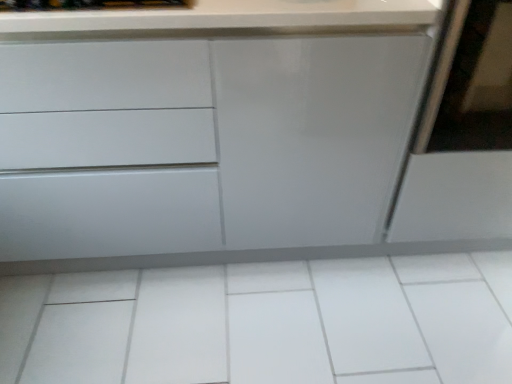
The image size is (512, 384). What do you see at coordinates (232, 138) in the screenshot?
I see `matte white cabinet at center` at bounding box center [232, 138].

What are the coordinates of `matte white screen door at right` in the screenshot? It's located at (452, 181).

Measure the distance between matte white screen door at right and matte white cabinet at center.

A distance of 13.33 inches exists between matte white screen door at right and matte white cabinet at center.

Is the depth of matte white screen door at right greater than that of matte white cabinet at center?

Yes, it is.

Can you see matte white screen door at right touching matte white cabinet at center?

No, matte white screen door at right is not with matte white cabinet at center.

Is matte white screen door at right surrounded by matte white cabinet at center?

Actually, matte white screen door at right is outside matte white cabinet at center.

Can you confirm if matte white cabinet at center is thinner than matte white screen door at right?

Indeed, matte white cabinet at center has a lesser width compared to matte white screen door at right.

What's the angular difference between white glossy tile at center and matte white screen door at right's facing directions?

89.2 degrees.

Could you tell me if white glossy tile at center is turned towards matte white screen door at right?

No, white glossy tile at center does not turn towards matte white screen door at right.

Does white glossy tile at center have a lesser height compared to matte white screen door at right?

Indeed, white glossy tile at center has a lesser height compared to matte white screen door at right.

From the image's perspective, which one is positioned lower, white glossy tile at center or matte white screen door at right?

From the image's view, white glossy tile at center is below.

Considering the sizes of objects matte white screen door at right and white glossy tile at center in the image provided, who is taller, matte white screen door at right or white glossy tile at center?

With more height is matte white screen door at right.

From the image's perspective, is matte white screen door at right positioned above or below white glossy tile at center?

Based on their image positions, matte white screen door at right is located above white glossy tile at center.

Which is more to the right, matte white screen door at right or white glossy tile at center?

matte white screen door at right is more to the right.

Can you tell me how much matte white screen door at right and white glossy tile at center differ in facing direction?

89.2 degrees separate the facing orientations of matte white screen door at right and white glossy tile at center.

Could you tell me if white glossy tile at center is facing matte white cabinet at center?

No.

Find the location of a particular element. This screenshot has width=512, height=384. the chest of drawers located above the white glossy tile at center (from the image's perspective) is located at coordinates (232, 138).

Is white glossy tile at center behind matte white cabinet at center?

Yes, the depth of white glossy tile at center is greater than that of matte white cabinet at center.

Is white glossy tile at center beside matte white cabinet at center?

No, white glossy tile at center is not in contact with matte white cabinet at center.

Based on their positions, is matte white cabinet at center located to the left or right of white glossy tile at center?

Clearly, matte white cabinet at center is on the left of white glossy tile at center in the image.

Does matte white cabinet at center contain white glossy tile at center?

No, matte white cabinet at center does not contain white glossy tile at center.

You are a GUI agent. You are given a task and a screenshot of the screen. Output one action in this format:
    pyautogui.click(x=<x>, y=<y>)
    Task: Click on the ceramic tile below the matte white cabinet at center (from the image's perspective)
    
    Given the screenshot: What is the action you would take?
    pyautogui.click(x=266, y=323)

Between matte white cabinet at center and white glossy tile at center, which one has less height?

With less height is white glossy tile at center.

At what (x,y) coordinates should I click in order to perform the action: click on screen door above the matte white cabinet at center (from the image's perspective). Please return your answer as a coordinate pair (x, y). Image resolution: width=512 pixels, height=384 pixels. Looking at the image, I should click on (452, 181).

This screenshot has width=512, height=384. In order to click on screen door behind the matte white cabinet at center in this screenshot , I will do `click(452, 181)`.

From the image, which object appears to be farther from matte white screen door at right, matte white cabinet at center or white glossy tile at center?

white glossy tile at center is further to matte white screen door at right.

Considering their positions, is white glossy tile at center positioned further to matte white cabinet at center than matte white screen door at right?

white glossy tile at center is positioned further to the anchor matte white cabinet at center.

Which object lies further to the anchor point white glossy tile at center, matte white cabinet at center or matte white screen door at right?

Among the two, matte white screen door at right is located further to white glossy tile at center.

Based on their spatial positions, is white glossy tile at center or matte white cabinet at center closer to matte white screen door at right?

The object closer to matte white screen door at right is matte white cabinet at center.

Which object lies nearer to the anchor point white glossy tile at center, matte white screen door at right or matte white cabinet at center?

matte white cabinet at center is positioned closer to the anchor white glossy tile at center.

Estimate the real-world distances between objects in this image. Which object is closer to matte white cabinet at center, matte white screen door at right or white glossy tile at center?

Based on the image, matte white screen door at right appears to be nearer to matte white cabinet at center.

The height and width of the screenshot is (384, 512). What are the coordinates of `ceramic tile located between matte white cabinet at center and matte white screen door at right in the left-right direction` in the screenshot? It's located at (266, 323).